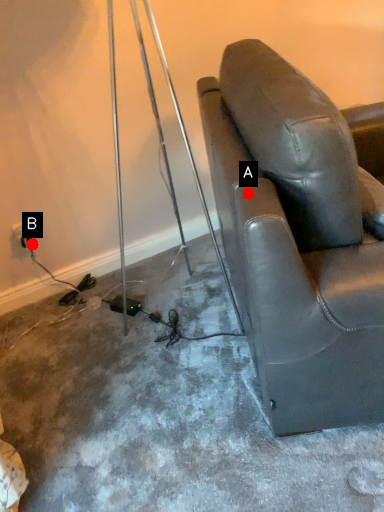
Question: Two points are circled on the image, labeled by A and B beside each circle. Which of the following is the farthest from the observer?

Choices:
 (A) A is further
 (B) B is further

Answer: (B)